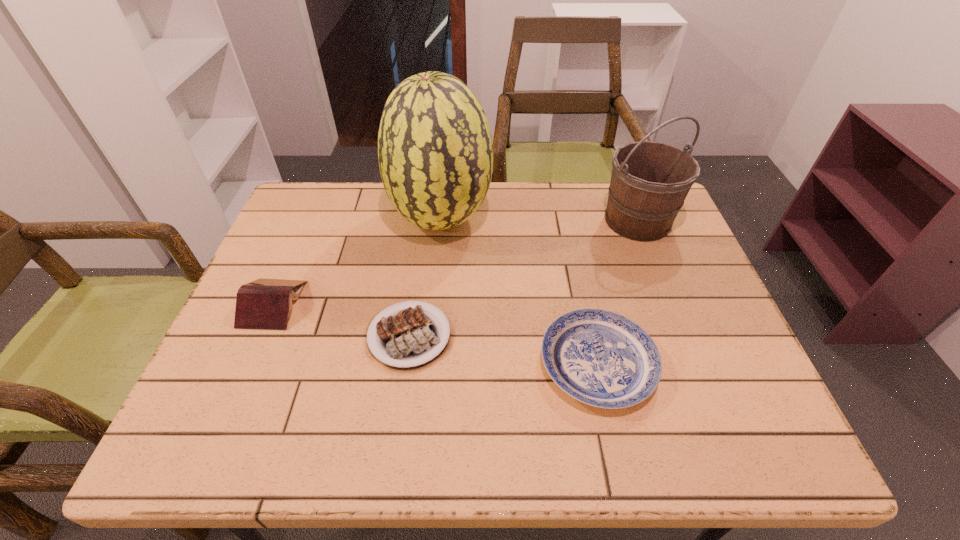
The width and height of the screenshot is (960, 540). Find the location of `vacant area at the left edge`. vacant area at the left edge is located at coordinates (301, 264).

Where is `free space at the right edge of the desktop`? Image resolution: width=960 pixels, height=540 pixels. free space at the right edge of the desktop is located at coordinates (670, 322).

The height and width of the screenshot is (540, 960). In order to click on free space at the far left corner in this screenshot , I will do [x=343, y=187].

In the image, there is a desktop. Where is `vacant space at the near left corner`? The height and width of the screenshot is (540, 960). vacant space at the near left corner is located at coordinates (218, 449).

Find the location of a particular element. The width and height of the screenshot is (960, 540). free space at the near right corner of the desktop is located at coordinates (717, 423).

Identify the location of free space that is in between the bucket and the right plate. (617, 292).

Identify the location of free space between the tallest object and the shortest object. (425, 278).

Find the location of `free space between the left plate and the taller plate`. free space between the left plate and the taller plate is located at coordinates (503, 349).

Find the location of `free space between the second shortest object and the bucket`. free space between the second shortest object and the bucket is located at coordinates (617, 292).

I want to click on vacant area that lies between the fourth shortest object and the watermelon, so click(540, 220).